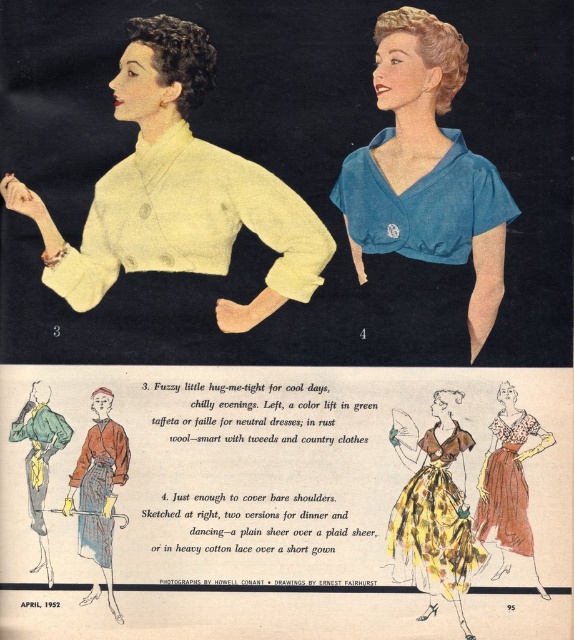
Looking at the vintage fashion spread from April 1952, you notice two garments displayed on the models. The first is the matte yellow sweater at center, and the second is the rust wool robe at lower left. Which garment is layered on top of the other?

The matte yellow sweater at center is positioned over the rust wool robe at lower left, indicating it is layered on top.

You are a photographer standing 2 meters away from the matte yellow sweater at center. Can you reach it without moving your feet?

The matte yellow sweater at center is 1.99 meters away from the viewer, so yes, you can reach it without moving your feet since it is just 1 centimeter closer than your standing distance.